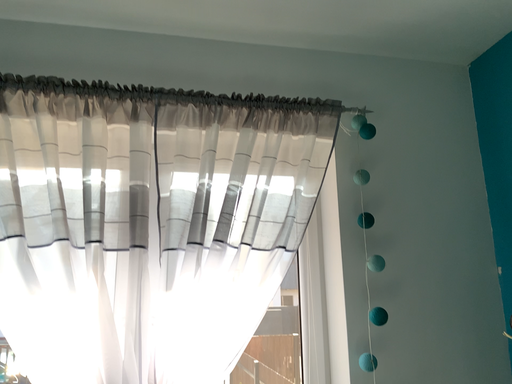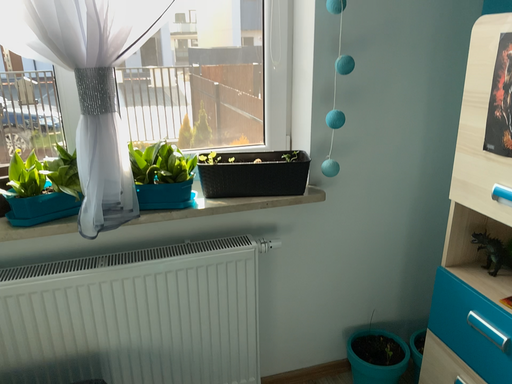
Question: How did the camera likely rotate when shooting the video?

Choices:
 (A) rotated downward
 (B) rotated upward

Answer: (A)